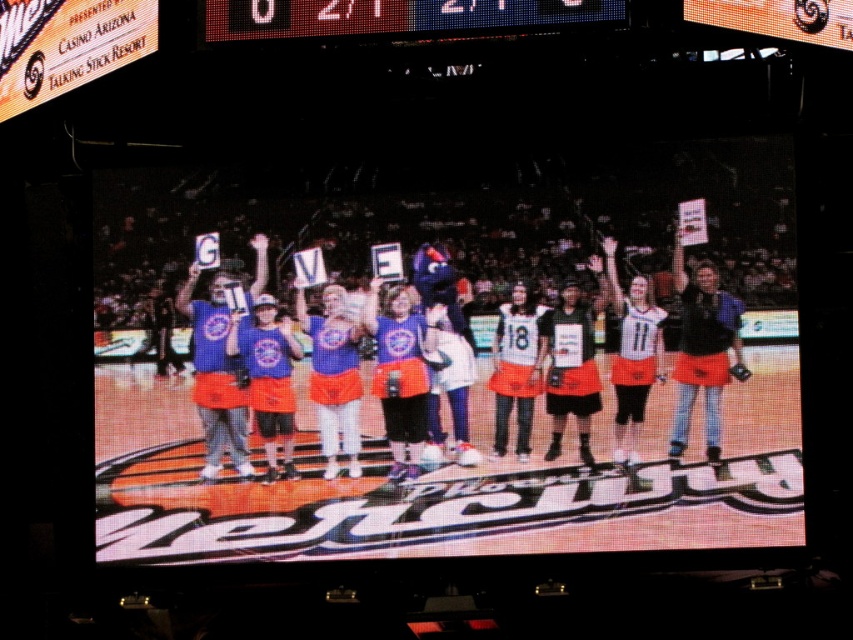
Question: Is blue jersey at center wider than led digital display at upper center?

Choices:
 (A) yes
 (B) no

Answer: (A)

Question: Which point appears closest to the camera in this image?

Choices:
 (A) (631, 285)
 (B) (270, 17)

Answer: (B)

Question: Can you confirm if blue jersey at center is wider than led digital display at upper center?

Choices:
 (A) no
 (B) yes

Answer: (B)

Question: Where is blue jersey at center located in relation to led digital display at upper center in the image?

Choices:
 (A) left
 (B) right

Answer: (B)